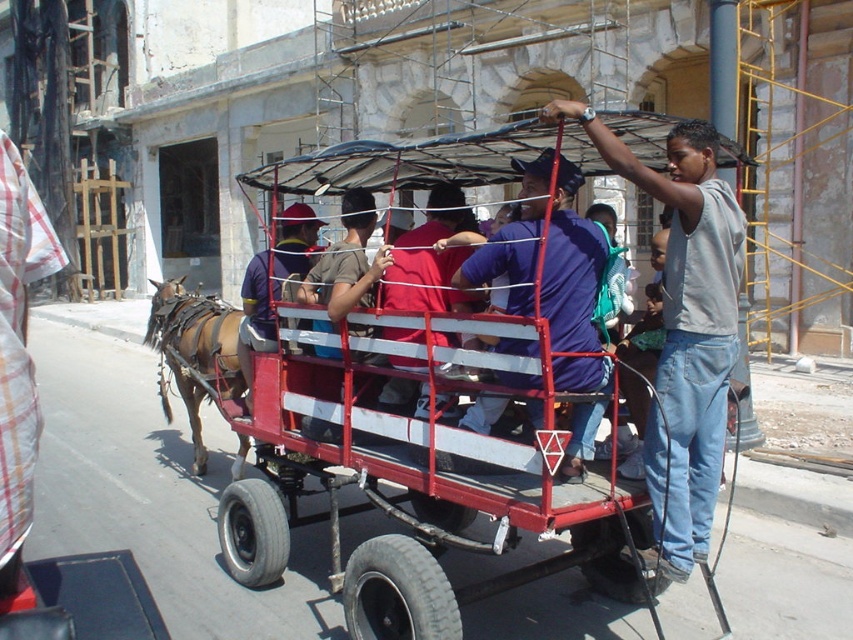
Does metallic red cart at center appear over brushed metal helmet at center?

Actually, metallic red cart at center is below brushed metal helmet at center.

Locate an element on the screen. metallic red cart at center is located at coordinates (430, 429).

Where is `metallic red cart at center`? metallic red cart at center is located at coordinates (430, 429).

Is metallic red cart at center further to the viewer compared to blue denim shirt at center?

No, metallic red cart at center is in front of blue denim shirt at center.

Where is `metallic red cart at center`? metallic red cart at center is located at coordinates (430, 429).

The height and width of the screenshot is (640, 853). Find the location of `metallic red cart at center`. metallic red cart at center is located at coordinates (430, 429).

Consider the image. Who is more forward, (160, 289) or (418, 269)?

Point (418, 269)

Does brown leather harness at left appear on the left side of red fabric shirt at center?

Correct, you'll find brown leather harness at left to the left of red fabric shirt at center.

Consider the image. Measure the distance between brown leather harness at left and camera.

They are 23.03 feet apart.

This screenshot has height=640, width=853. What are the coordinates of `brown leather harness at left` in the screenshot? It's located at (194, 353).